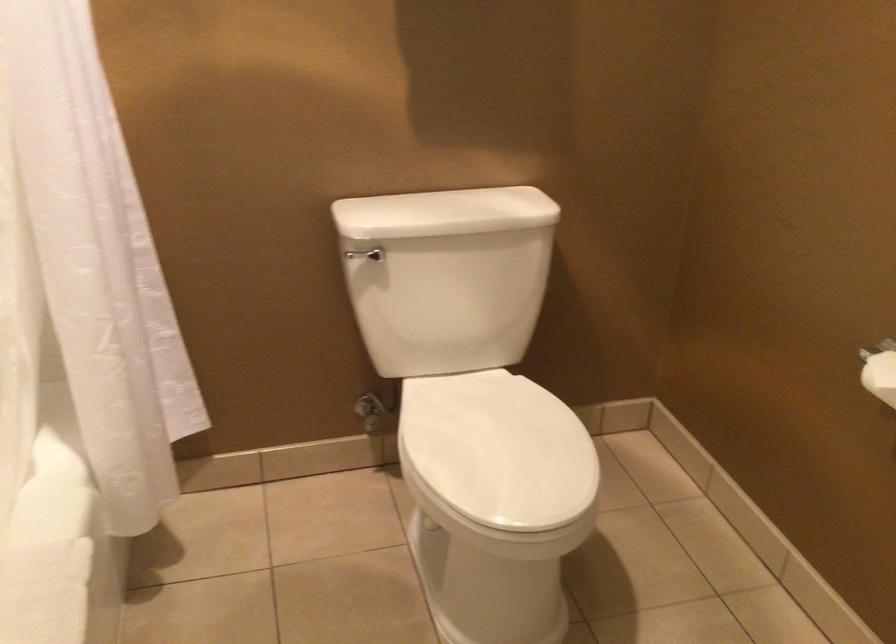
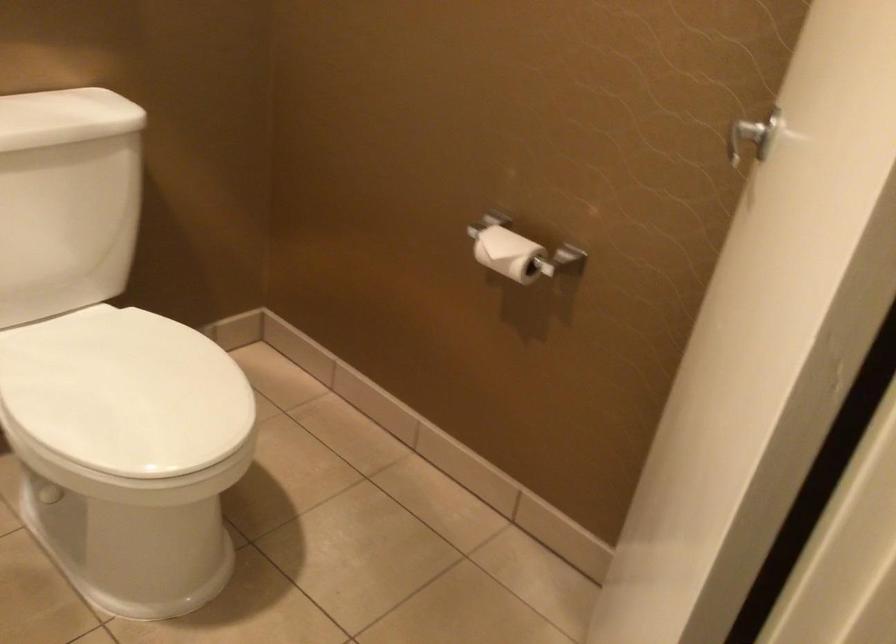
Locate, in the second image, the point that corresponds to the point at 488,448 in the first image.

(125, 393)